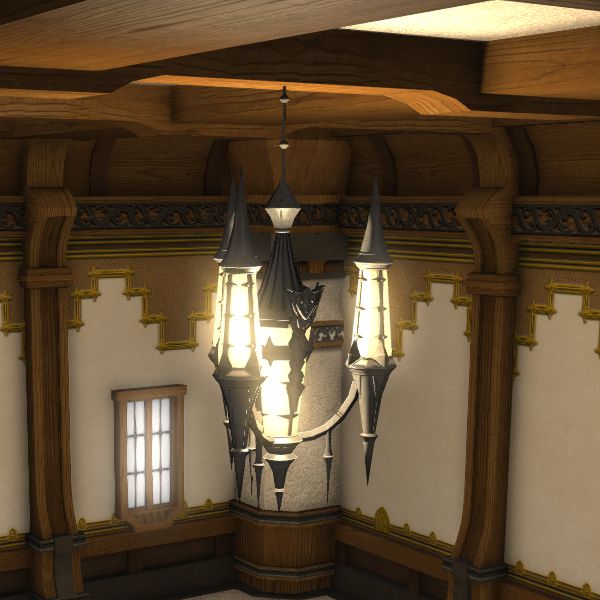
This screenshot has height=600, width=600. In order to click on floor in this screenshot , I will do `click(235, 595)`.